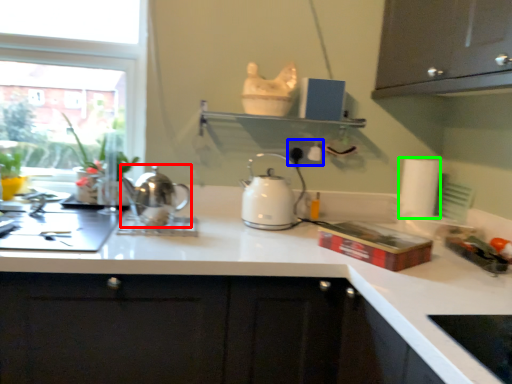
Question: Which object is positioned closest to kettle (highlighted by a red box)? Select from electric outlet (highlighted by a blue box) and paper towel (highlighted by a green box).

Choices:
 (A) electric outlet
 (B) paper towel

Answer: (A)